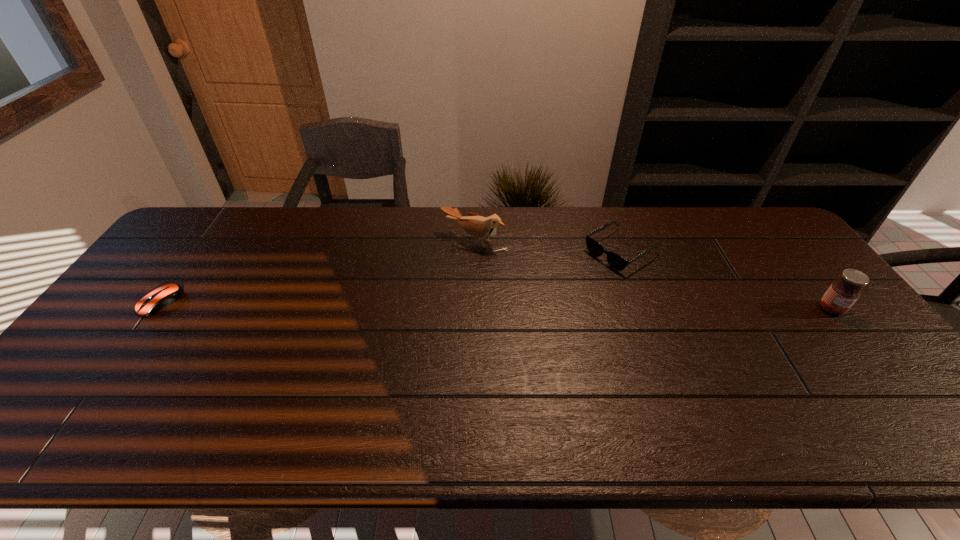
Find the location of `blank region between the bird and the sunglasses`. blank region between the bird and the sunglasses is located at coordinates (547, 246).

Find the location of a particular element. The width and height of the screenshot is (960, 540). free space that is in between the bird and the shortest object is located at coordinates (317, 272).

Find the location of a particular element. free spot between the second object from left to right and the jam is located at coordinates (653, 275).

Locate an element on the screen. vacant region between the bird and the second shortest object is located at coordinates (547, 246).

Where is `object that stands as the closest to the shortest object`? The height and width of the screenshot is (540, 960). object that stands as the closest to the shortest object is located at coordinates (480, 227).

The width and height of the screenshot is (960, 540). In order to click on the third closest object to the computer mouse in this screenshot , I will do `click(842, 294)`.

Where is `free space that satisfies the following two spatial constraints: 1. on the front side of the second shortest object; 2. on the left side of the third object from right to left`? This screenshot has width=960, height=540. free space that satisfies the following two spatial constraints: 1. on the front side of the second shortest object; 2. on the left side of the third object from right to left is located at coordinates point(474,251).